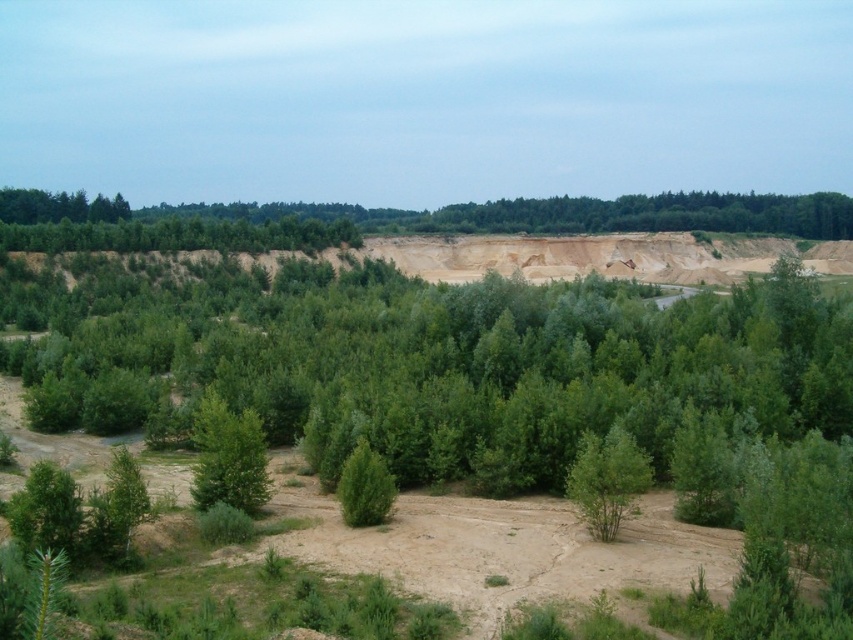
You are a surveyor tasked with mapping the landscape. You need to determine the exact location of the green leafy tree at center. What are its coordinates?

The green leafy tree at center is located at point (x=228, y=456).

You are standing at the point labeled as point (x=607, y=480) in the image. What is the nearest object to you?

The point (x=607, y=480) is on green leafy bush at center, so the nearest object to you is the green leafy bush at center.